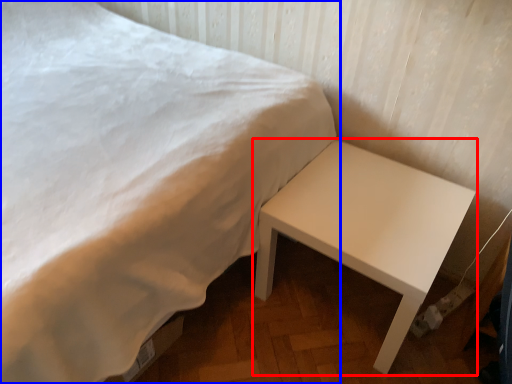
Question: Which object appears farthest to the camera in this image, table (highlighted by a red box) or bed (highlighted by a blue box)?

Choices:
 (A) table
 (B) bed

Answer: (A)